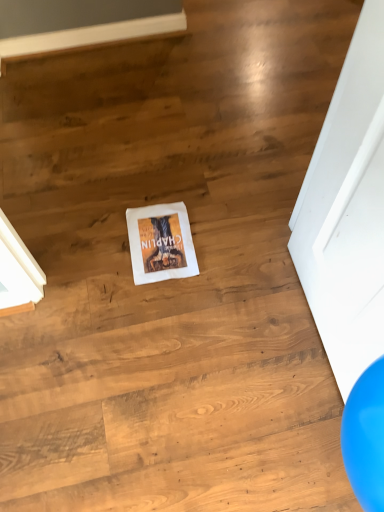
Locate an element on the screen. vacant region to the right of white cloth at center is located at coordinates (224, 229).